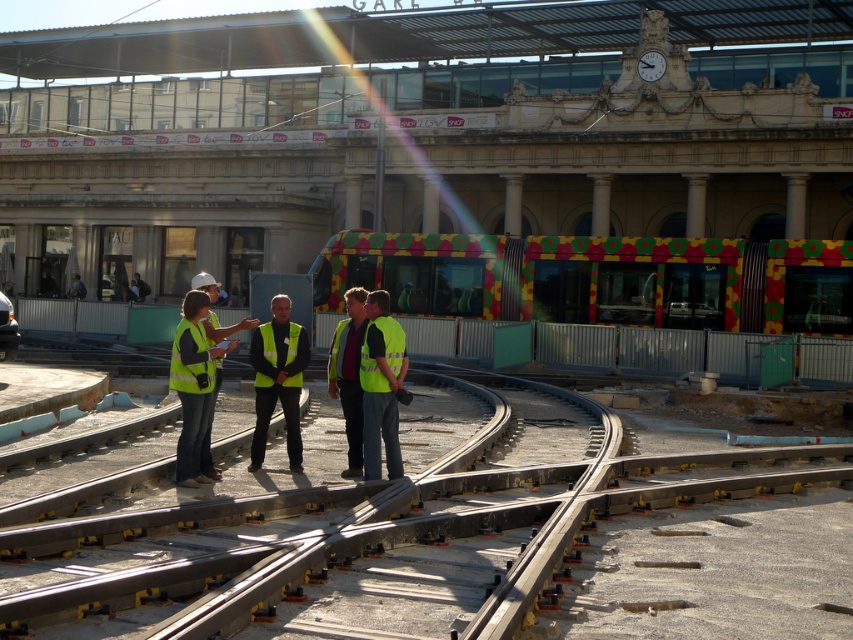
Question: Which point is farther to the camera?

Choices:
 (A) (289, 349)
 (B) (396, 461)

Answer: (A)

Question: Which point is closer to the camera taking this photo?

Choices:
 (A) (384, 355)
 (B) (387, 417)

Answer: (A)

Question: Does yellow reflective vest at center appear on the left side of bright yellow reflective safety vest at center?

Choices:
 (A) no
 (B) yes

Answer: (A)

Question: Considering the relative positions of bright yellow reflective safety vest at center and yellow reflective safety vest at center in the image provided, where is bright yellow reflective safety vest at center located with respect to yellow reflective safety vest at center?

Choices:
 (A) left
 (B) right

Answer: (B)

Question: Is yellow reflective vest at center bigger than bright yellow reflective safety vest at center?

Choices:
 (A) no
 (B) yes

Answer: (B)

Question: Which point appears closest to the camera in this image?

Choices:
 (A) (386, 392)
 (B) (397, 371)

Answer: (A)